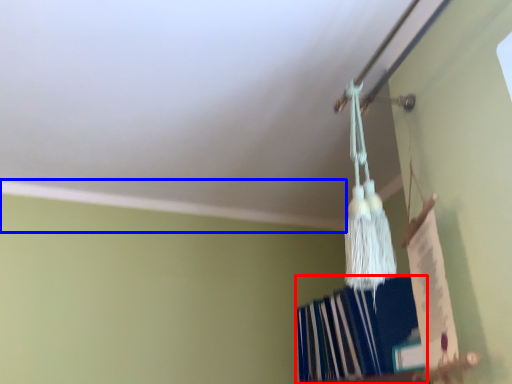
Question: Which object appears closest to the camera in this image, book (highlighted by a red box) or trim (highlighted by a blue box)?

Choices:
 (A) book
 (B) trim

Answer: (A)